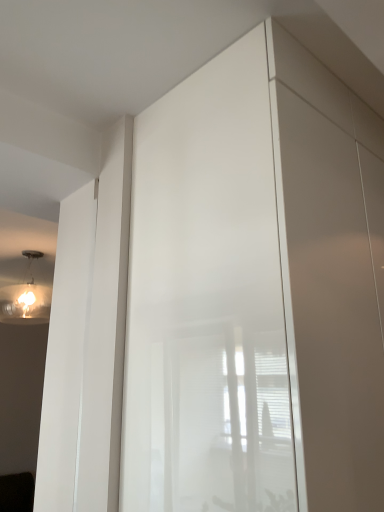
Question: Which is correct: glossy white screen door at center is inside matte white bulb at upper left, or outside of it?

Choices:
 (A) inside
 (B) outside

Answer: (B)

Question: Does point (264, 170) appear closer or farther from the camera than point (34, 318)?

Choices:
 (A) farther
 (B) closer

Answer: (B)

Question: From a real-world perspective, is glossy white screen door at center above or below matte white bulb at upper left?

Choices:
 (A) below
 (B) above

Answer: (A)

Question: Considering the positions of matte white bulb at upper left and glossy white screen door at center in the image, is matte white bulb at upper left bigger or smaller than glossy white screen door at center?

Choices:
 (A) big
 (B) small

Answer: (B)

Question: From their relative heights in the image, would you say matte white bulb at upper left is taller or shorter than glossy white screen door at center?

Choices:
 (A) short
 (B) tall

Answer: (A)

Question: Is matte white bulb at upper left wider or thinner than glossy white screen door at center?

Choices:
 (A) thin
 (B) wide

Answer: (A)

Question: From the image's perspective, is matte white bulb at upper left located above or below glossy white screen door at center?

Choices:
 (A) below
 (B) above

Answer: (A)